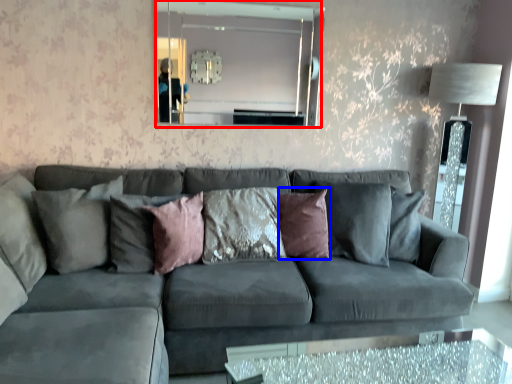
Question: Which object appears farthest to the camera in this image, mirror (highlighted by a red box) or pillow (highlighted by a blue box)?

Choices:
 (A) mirror
 (B) pillow

Answer: (A)